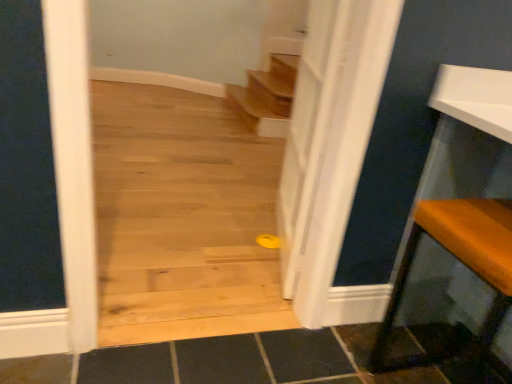
Find the location of a particular element. free space behind white glossy door at center is located at coordinates (242, 213).